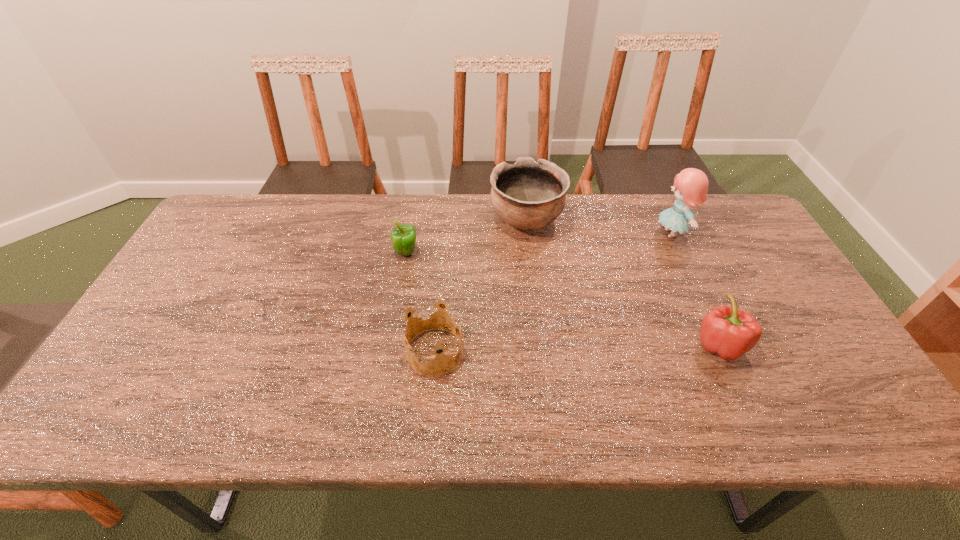
I want to click on free space at the far left corner of the desktop, so click(x=233, y=229).

At what (x,y) coordinates should I click in order to perform the action: click on blank area at the far right corner. Please return your answer as a coordinate pair (x, y). Looking at the image, I should click on (707, 224).

This screenshot has height=540, width=960. What are the coordinates of `vacant space that's between the crown and the doll` in the screenshot? It's located at (553, 293).

Where is `vacant space in between the second object from left to right and the nearer bell pepper`? vacant space in between the second object from left to right and the nearer bell pepper is located at coordinates (577, 348).

This screenshot has height=540, width=960. In order to click on free spot between the right bell pepper and the leftmost object in this screenshot , I will do `click(563, 299)`.

At what (x,y) coordinates should I click in order to perform the action: click on free space between the tallest object and the farther bell pepper. Please return your answer as a coordinate pair (x, y). Looking at the image, I should click on click(x=539, y=244).

Find the location of a particular element. The height and width of the screenshot is (540, 960). vacant area between the right bell pepper and the third object from left to right is located at coordinates (623, 282).

Image resolution: width=960 pixels, height=540 pixels. Identify the location of vacant area that lies between the right bell pepper and the third object from left to right. (623, 282).

This screenshot has height=540, width=960. I want to click on empty space between the right bell pepper and the second tallest object, so click(623, 282).

The height and width of the screenshot is (540, 960). In order to click on free space between the fourth object from right to left and the nearer bell pepper in this screenshot , I will do `click(577, 348)`.